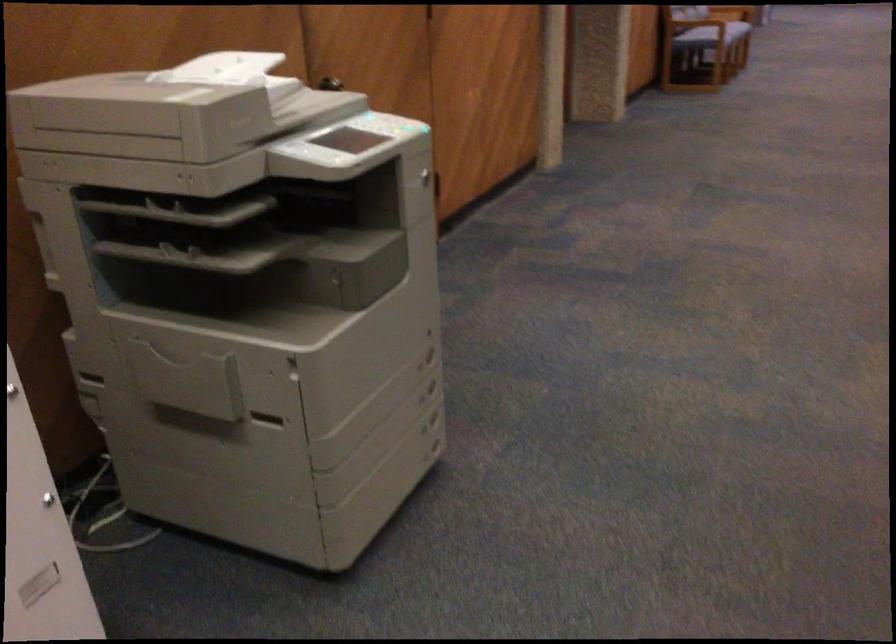
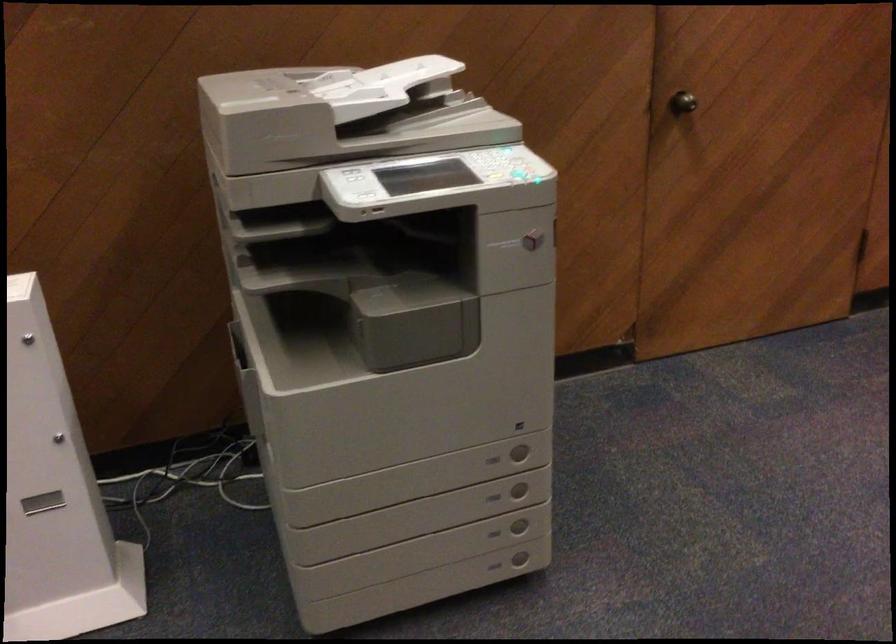
In the second image, find the point that corresponds to point (290, 149) in the first image.

(354, 175)